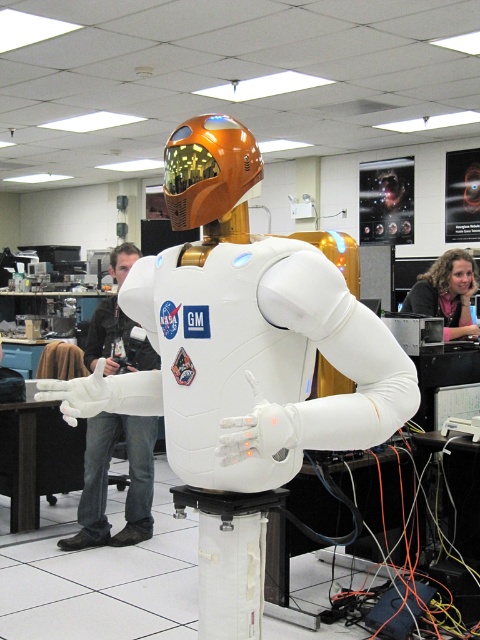
Question: Estimate the real-world distances between objects in this image. Which object is closer to the white matte astronaut at center?

Choices:
 (A) pink fabric at upper right
 (B) jeans at left

Answer: (B)

Question: Which object appears farthest from the camera in this image?

Choices:
 (A) pink fabric at upper right
 (B) white matte astronaut at center

Answer: (A)

Question: Is jeans at left positioned in front of pink fabric at upper right?

Choices:
 (A) yes
 (B) no

Answer: (B)

Question: Does white matte astronaut at center have a greater width compared to pink fabric at upper right?

Choices:
 (A) no
 (B) yes

Answer: (B)

Question: Is white matte astronaut at center wider than jeans at left?

Choices:
 (A) no
 (B) yes

Answer: (B)

Question: Which point is farther to the camera?

Choices:
 (A) jeans at left
 (B) pink fabric at upper right

Answer: (A)